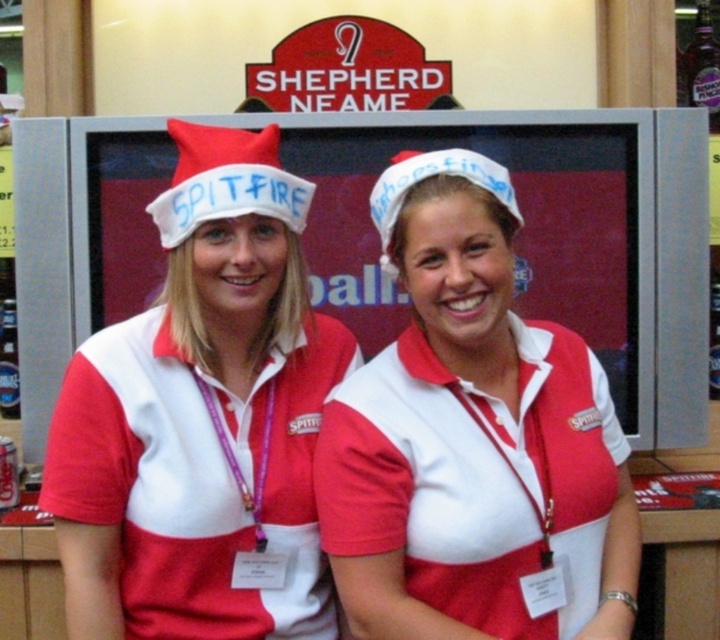
Describe the element at coordinates (202, 419) in the screenshot. The image size is (720, 640). I see `matte fabric hat at center` at that location.

Based on the photo, who is taller, matte fabric hat at center or white matte santa hat at center?

Standing taller between the two is matte fabric hat at center.

Does point (140, 369) lie behind point (500, 416)?

No.

Where is `matte fabric hat at center`? Image resolution: width=720 pixels, height=640 pixels. matte fabric hat at center is located at coordinates (202, 419).

Which is in front, point (294, 321) or point (266, 205)?

Point (266, 205)

Where is `matte fabric hat at center`? matte fabric hat at center is located at coordinates (202, 419).

Does white matte santa hat at center have a lesser height compared to red felt santa hat at center?

In fact, white matte santa hat at center may be taller than red felt santa hat at center.

Does white matte santa hat at center appear on the right side of red felt santa hat at center?

Yes, white matte santa hat at center is to the right of red felt santa hat at center.

Between point (608, 563) and point (238, 150), which one is positioned in front?

Point (238, 150) is in front.

Locate an element on the screen. white matte santa hat at center is located at coordinates (472, 440).